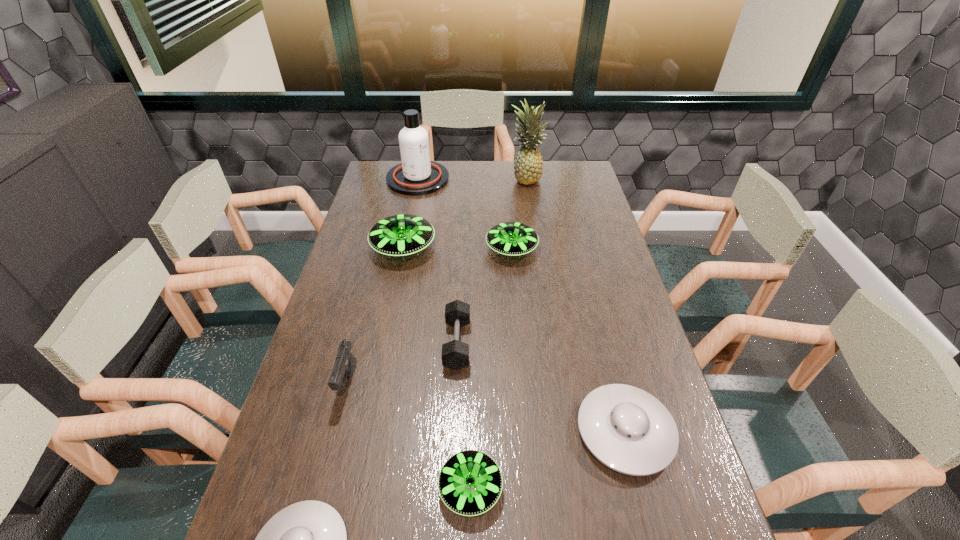
This screenshot has width=960, height=540. I want to click on free spot between the dumbbell and the second biggest green saucer, so click(485, 296).

In order to click on vacant region between the smallest green saucer and the right gray saucer in this screenshot , I will do `click(548, 460)`.

This screenshot has width=960, height=540. Find the location of `empty location between the tallest saucer and the pineapple`. empty location between the tallest saucer and the pineapple is located at coordinates (465, 213).

Find the location of a particular element. This screenshot has height=540, width=960. free space between the farther gray saucer and the white cleansing agent is located at coordinates (521, 305).

The height and width of the screenshot is (540, 960). What are the coordinates of `free space between the pineapple and the tallest saucer` in the screenshot? It's located at (465, 213).

At what (x,y) coordinates should I click in order to perform the action: click on object identified as the closest to the black pistol. Please return your answer as a coordinate pair (x, y). The image size is (960, 540). Looking at the image, I should click on (308, 539).

Point out which object is positioned as the seventh nearest to the fourth shortest saucer. Please provide its 2D coordinates. Your answer should be formatted as a tuple, i.e. [(x, y)], where the tuple contains the x and y coordinates of a point satisfying the conditions above.

[(470, 482)]

Find the location of `saucer that can be found as the second closest to the nearer gray saucer`. saucer that can be found as the second closest to the nearer gray saucer is located at coordinates (627, 429).

You are a GUI agent. You are given a task and a screenshot of the screen. Output one action in this format:
    pyautogui.click(x=<x>, y=<y>)
    Task: Click on the saucer that stands as the third closest to the biggest green saucer
    Image resolution: width=960 pixels, height=540 pixels.
    Given the screenshot: What is the action you would take?
    pyautogui.click(x=470, y=482)

The width and height of the screenshot is (960, 540). Find the location of `green saucer identified as the third closest to the right gray saucer`. green saucer identified as the third closest to the right gray saucer is located at coordinates (400, 235).